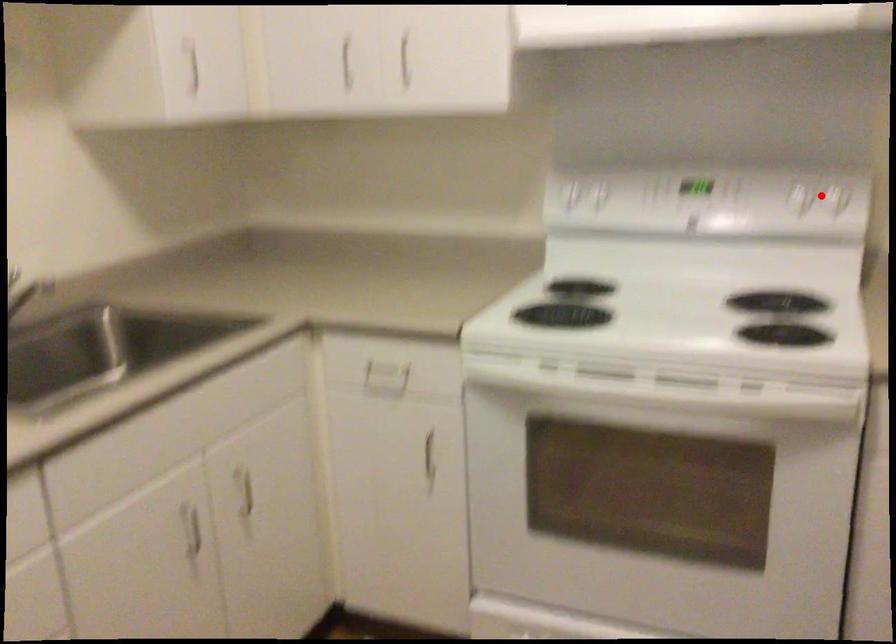
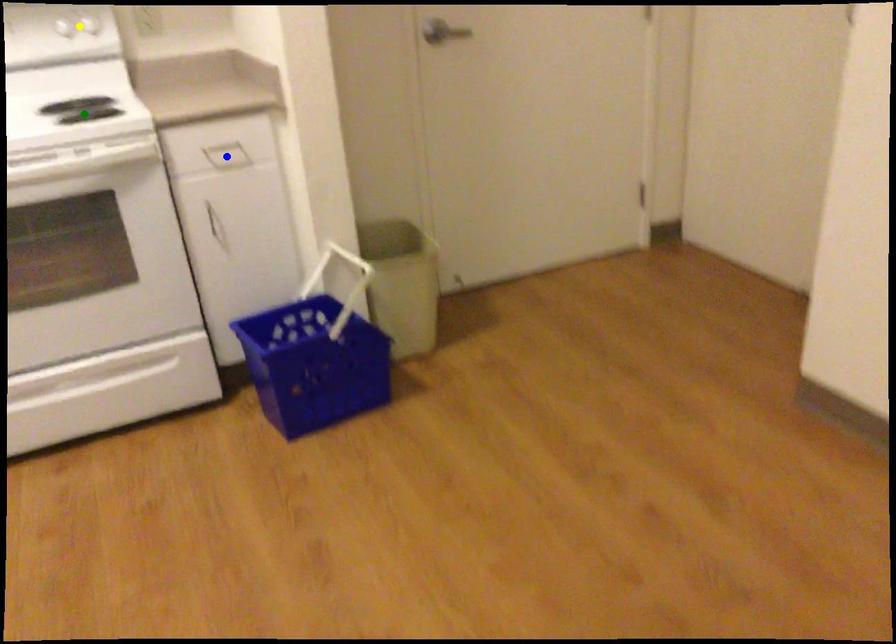
Question: I am providing you with two images of the same scene from different viewpoints. A red point is marked on the first image. You are given multiple points on the second image. Which mark in image 2 goes with the point in image 1?

Choices:
 (A) green point
 (B) blue point
 (C) yellow point

Answer: (C)